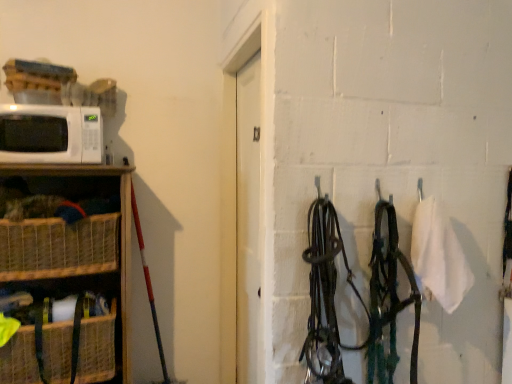
What are the coordinates of `woven brown basket at lower left, the 2th basket viewed from the top` in the screenshot? It's located at (97, 349).

Does white matte microwave at left lie behind woven wood shelf at left?

Yes, the depth of white matte microwave at left is greater than that of woven wood shelf at left.

Is white matte microwave at left far from woven wood shelf at left?

white matte microwave at left is near woven wood shelf at left, not far away.

Does white matte microwave at left turn towards woven wood shelf at left?

No, white matte microwave at left does not turn towards woven wood shelf at left.

Could you tell me if woven brown basket at lower left, the 1th basket from the bottom, is turned towards white matte microwave at left?

No, woven brown basket at lower left, the 1th basket from the bottom, is not turned towards white matte microwave at left.

From the picture: Is woven brown basket at lower left, the 1th basket from the bottom, next to white matte microwave at left?

No, woven brown basket at lower left, the 1th basket from the bottom, is not in contact with white matte microwave at left.

There is a woven brown basket at lower left, the 1th basket from the bottom. Where is `microwave oven above it (from a real-world perspective)`? This screenshot has width=512, height=384. microwave oven above it (from a real-world perspective) is located at coordinates point(50,134).

Which is in front, woven brown basket at lower left, the 1th basket from the bottom, or white matte microwave at left?

woven brown basket at lower left, the 1th basket from the bottom, is in front.

What's the angular difference between woven wood shelf at left and white matte microwave at left's facing directions?

The angle between the facing direction of woven wood shelf at left and the facing direction of white matte microwave at left is 1.63 degrees.

Based on the photo, considering the relative sizes of woven wood shelf at left and white matte microwave at left in the image provided, is woven wood shelf at left wider than white matte microwave at left?

Yes, woven wood shelf at left is wider than white matte microwave at left.

Does woven wood shelf at left touch white matte microwave at left?

No.

From a real-world perspective, which object stands above the other?

In real-world perspective, white matte microwave at left is above.

Does white matte microwave at left turn towards woven brown basket at left, which appears as the first basket when viewed from the top?

No, white matte microwave at left does not turn towards woven brown basket at left, which appears as the first basket when viewed from the top.

Looking at this image, from the image's perspective, is white matte microwave at left on top of woven brown basket at left, which appears as the first basket when viewed from the top?

Indeed, from the image's perspective, white matte microwave at left is shown above woven brown basket at left, which appears as the first basket when viewed from the top.

Does white matte microwave at left come behind woven brown basket at left, which appears as the first basket when viewed from the top?

Yes, white matte microwave at left is behind woven brown basket at left, which appears as the first basket when viewed from the top.

Can you tell me how much woven wood shelf at left and woven brown basket at lower left, the 1th basket from the bottom, differ in facing direction?

The angle between the facing direction of woven wood shelf at left and the facing direction of woven brown basket at lower left, the 1th basket from the bottom, is 0.000912 degrees.

Is point (41, 171) closer or farther from the camera than point (17, 377)?

Point (41, 171) appears to be farther away from the viewer than point (17, 377).

I want to click on basket located below the woven wood shelf at left (from the image's perspective), so click(x=97, y=349).

In the image, is woven wood shelf at left positioned in front of or behind woven brown basket at lower left, the 1th basket from the bottom?

woven wood shelf at left is positioned closer to the viewer than woven brown basket at lower left, the 1th basket from the bottom.

Measure the distance from woven brown basket at lower left, the 2th basket viewed from the top, to woven wood shelf at left.

woven brown basket at lower left, the 2th basket viewed from the top, is 12.69 inches from woven wood shelf at left.

From the picture: Is woven brown basket at lower left, the 1th basket from the bottom, oriented away from woven wood shelf at left?

That's right, woven brown basket at lower left, the 1th basket from the bottom, is facing away from woven wood shelf at left.

From the woven wood shelf at left, count 1st baskets backward and point to it. Please provide its 2D coordinates.

[(97, 349)]

From the image's perspective, is woven brown basket at lower left, the 1th basket from the bottom, above or below woven wood shelf at left?

From the image's perspective, woven brown basket at lower left, the 1th basket from the bottom, appears below woven wood shelf at left.

In terms of height, does woven brown basket at left, the second basket when ordered from bottom to top, look taller or shorter compared to white matte microwave at left?

Considering their sizes, woven brown basket at left, the second basket when ordered from bottom to top, has more height than white matte microwave at left.

From a real-world perspective, is woven brown basket at left, which appears as the first basket when viewed from the top, below white matte microwave at left?

Indeed, from a real-world perspective, woven brown basket at left, which appears as the first basket when viewed from the top, is positioned beneath white matte microwave at left.

Could you measure the distance between woven brown basket at left, which appears as the first basket when viewed from the top, and white matte microwave at left?

They are 14.15 inches apart.

Is woven brown basket at left, the second basket when ordered from bottom to top, next to white matte microwave at left?

woven brown basket at left, the second basket when ordered from bottom to top, and white matte microwave at left are not in contact.

At what (x,y) coordinates should I click in order to perform the action: click on microwave oven positioned vertically above the woven wood shelf at left (from a real-world perspective). Please return your answer as a coordinate pair (x, y). The height and width of the screenshot is (384, 512). Looking at the image, I should click on (50, 134).

In order to click on the 2nd basket below the white matte microwave at left (from the image's perspective) in this screenshot , I will do `click(97, 349)`.

Based on their spatial positions, is woven brown basket at left, the second basket when ordered from bottom to top, or white matte microwave at left closer to woven wood shelf at left?

white matte microwave at left lies closer to woven wood shelf at left than the other object.

Considering their positions, is white matte microwave at left positioned closer to woven wood shelf at left than woven brown basket at lower left, the 2th basket viewed from the top?

white matte microwave at left is positioned closer to the anchor woven wood shelf at left.

Considering their positions, is woven brown basket at left, the second basket when ordered from bottom to top, positioned further to white matte microwave at left than woven wood shelf at left?

woven brown basket at left, the second basket when ordered from bottom to top, is positioned further to the anchor white matte microwave at left.

Looking at the image, which one is located further to woven brown basket at left, the second basket when ordered from bottom to top, woven brown basket at lower left, the 2th basket viewed from the top, or white matte microwave at left?

white matte microwave at left is positioned further to the anchor woven brown basket at left, the second basket when ordered from bottom to top.

Which object lies nearer to the anchor point woven brown basket at left, the second basket when ordered from bottom to top, white matte microwave at left or woven wood shelf at left?

Based on the image, woven wood shelf at left appears to be nearer to woven brown basket at left, the second basket when ordered from bottom to top.

Based on their spatial positions, is woven brown basket at lower left, the 1th basket from the bottom, or woven wood shelf at left closer to white matte microwave at left?

Among the two, woven wood shelf at left is located nearer to white matte microwave at left.

When comparing their distances from woven brown basket at lower left, the 2th basket viewed from the top, does woven brown basket at left, the second basket when ordered from bottom to top, or white matte microwave at left seem further?

The object further to woven brown basket at lower left, the 2th basket viewed from the top, is white matte microwave at left.

Based on their spatial positions, is white matte microwave at left or woven brown basket at lower left, the 2th basket viewed from the top, further from woven brown basket at left, the second basket when ordered from bottom to top?

The object further to woven brown basket at left, the second basket when ordered from bottom to top, is white matte microwave at left.

Locate an element on the screen. shelf between white matte microwave at left and woven brown basket at lower left, the 2th basket viewed from the top, in the up-down direction is located at coordinates (121, 232).

This screenshot has height=384, width=512. Find the location of `basket between white matte microwave at left and woven wood shelf at left in the up-down direction`. basket between white matte microwave at left and woven wood shelf at left in the up-down direction is located at coordinates (58, 247).

At what (x,y) coordinates should I click in order to perform the action: click on basket between white matte microwave at left and woven brown basket at lower left, the 2th basket viewed from the top, vertically. Please return your answer as a coordinate pair (x, y). Looking at the image, I should click on (58, 247).

The height and width of the screenshot is (384, 512). What are the coordinates of `shelf between woven brown basket at left, the second basket when ordered from bottom to top, and woven brown basket at lower left, the 1th basket from the bottom, in the up-down direction` in the screenshot? It's located at (121, 232).